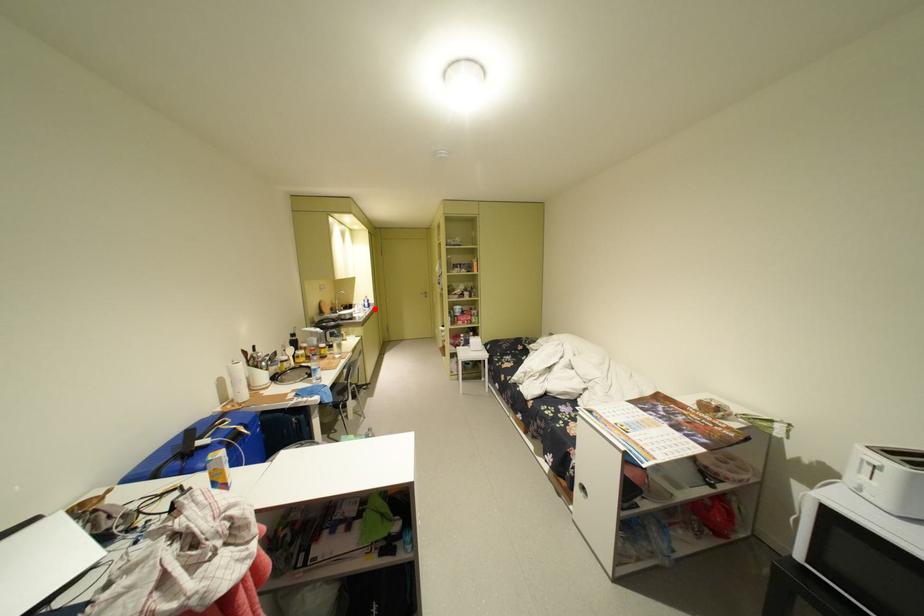
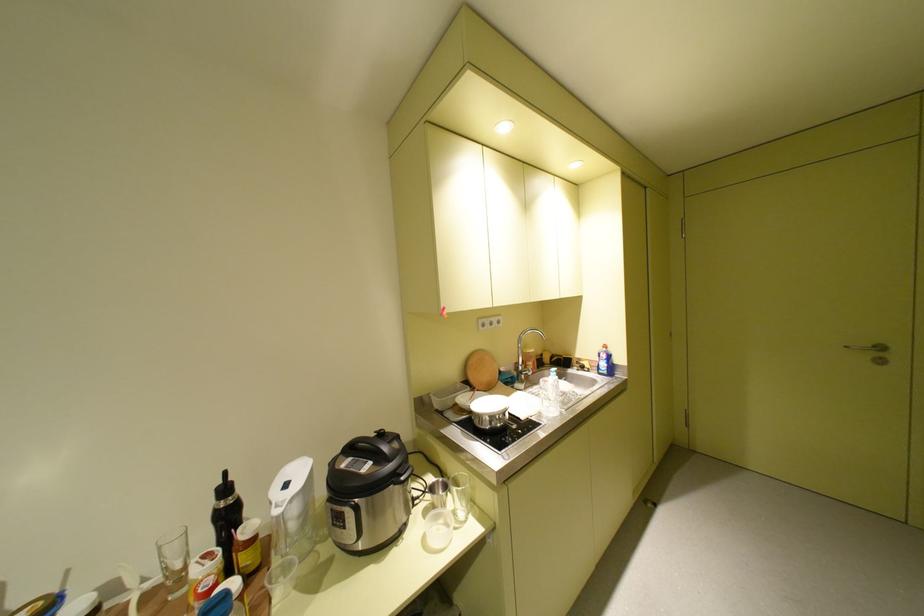
Question: I am providing you with two images of the same scene from different viewpoints. A red point is marked on the first image. At the location where the point appears in image 1, is it still visible in image 2?

Choices:
 (A) Yes
 (B) No

Answer: (A)